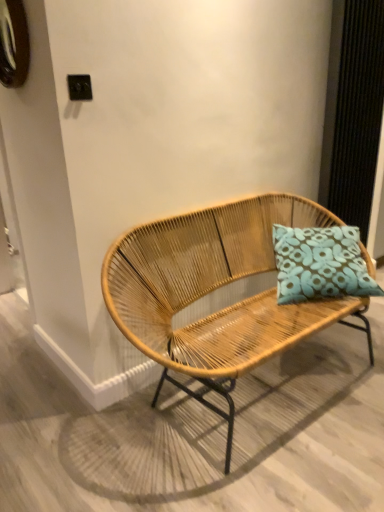
Locate an element on the screen. The width and height of the screenshot is (384, 512). free point below natural wood bench at center (from a real-world perspective) is located at coordinates (263, 396).